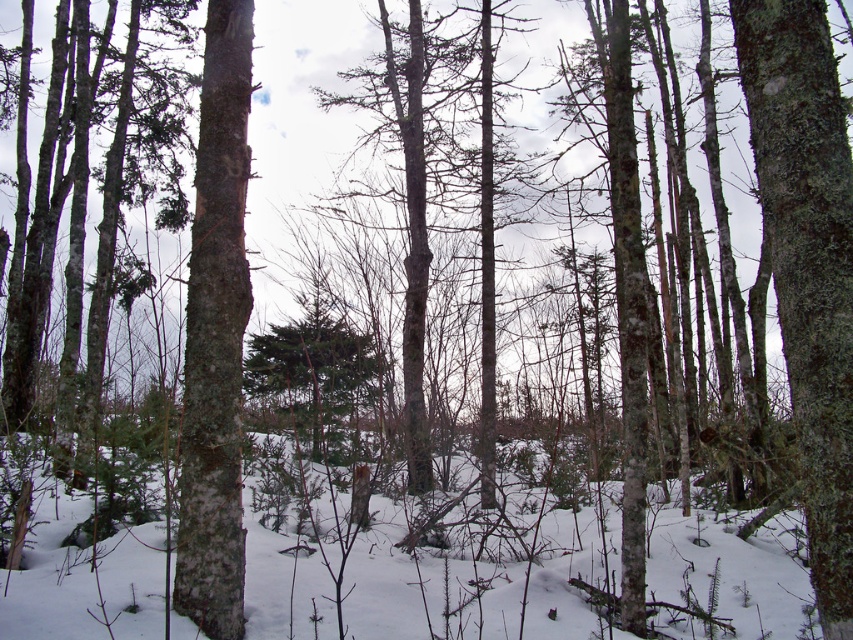
Consider the image. Is white powdery snow at center to the left of smooth white bark at center from the viewer's perspective?

Incorrect, white powdery snow at center is not on the left side of smooth white bark at center.

Who is more forward, (648, 620) or (230, 256)?

Point (230, 256)

Locate an element on the screen. white powdery snow at center is located at coordinates (476, 580).

Does point (302, 560) come behind point (816, 26)?

Yes.

Can you confirm if white powdery snow at center is positioned to the left of smooth bark tree at center?

Indeed, white powdery snow at center is positioned on the left side of smooth bark tree at center.

Measure the distance between white powdery snow at center and camera.

white powdery snow at center is 3.09 meters from camera.

Locate an element on the screen. The height and width of the screenshot is (640, 853). white powdery snow at center is located at coordinates (476, 580).

Is smooth bark tree at center to the left of smooth white bark at center from the viewer's perspective?

Incorrect, smooth bark tree at center is not on the left side of smooth white bark at center.

Locate an element on the screen. This screenshot has height=640, width=853. smooth bark tree at center is located at coordinates (807, 262).